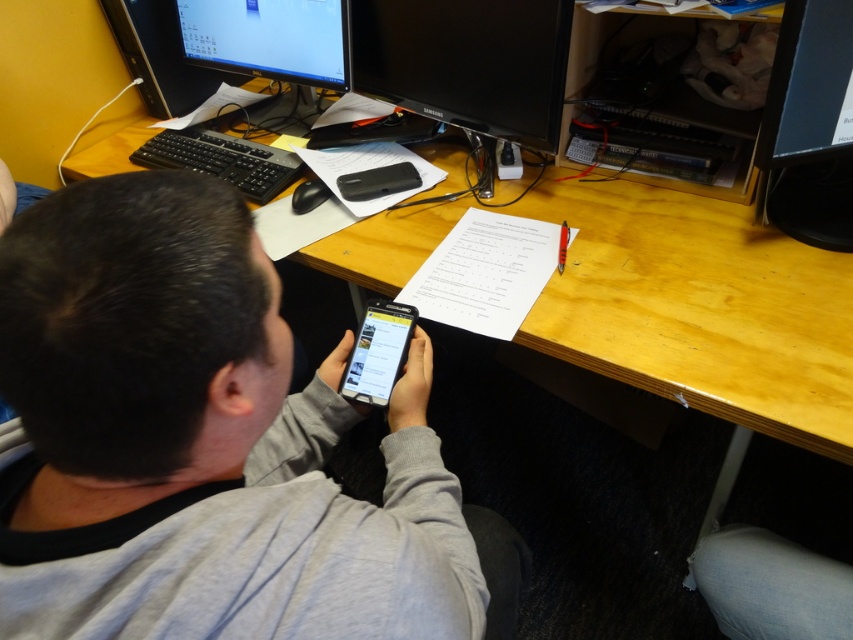
You are an office worker who needs to place a new 15 inch laptop between the black glossy monitor at upper left and the black glossy monitor at upper right. Can you fit it there based on their sizes?

The black glossy monitor at upper left is wider than the black glossy monitor at upper right. Since the laptop is 15 inches, it might fit between them if the combined space between the two monitors is sufficient. However, without knowing the exact distance between them, it is difficult to determine definitively.